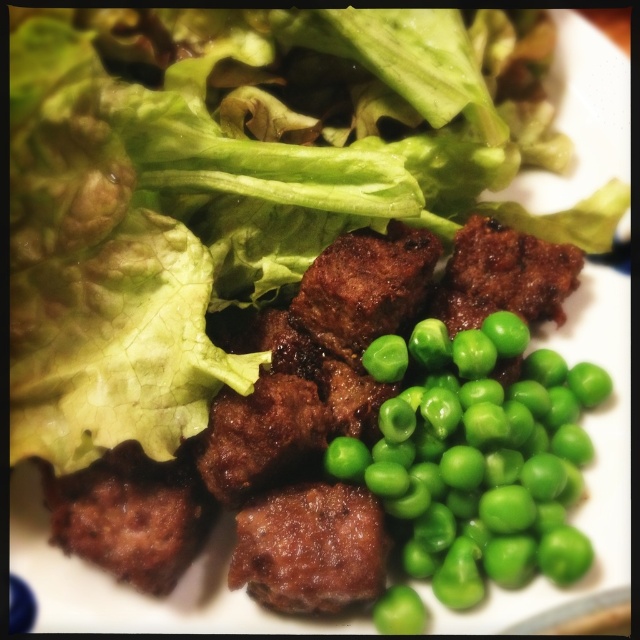
Does green matte peas at center-right appear over brown crispy meat at center?

Yes, green matte peas at center-right is above brown crispy meat at center.

At what (x,y) coordinates should I click in order to perform the action: click on green matte peas at center-right. Please return your answer as a coordinate pair (x, y). The image size is (640, 640). Looking at the image, I should click on (477, 458).

Locate an element on the screen. Image resolution: width=640 pixels, height=640 pixels. green matte peas at center-right is located at coordinates (477, 458).